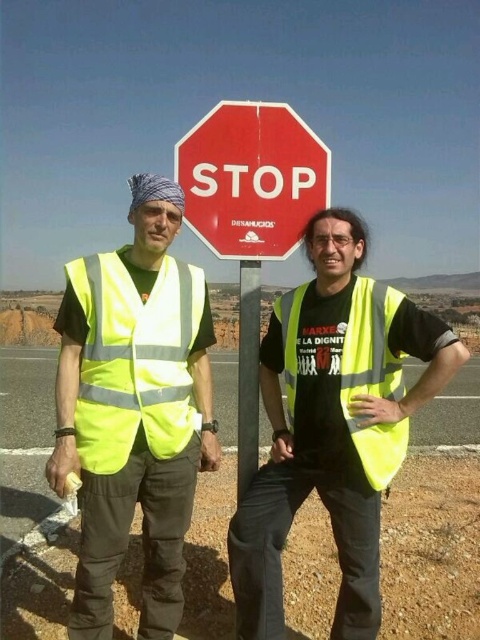
Question: Based on their relative distances, which object is nearer to the metallic gray pole at center?

Choices:
 (A) yellow reflective vest at center
 (B) high visibility yellow safety vest at center
 (C) yellow reflective safety vest at left

Answer: (A)

Question: Among these objects, which one is nearest to the camera?

Choices:
 (A) yellow reflective safety vest at left
 (B) yellow reflective vest at center
 (C) neon yellow reflective vest at left

Answer: (C)

Question: Is yellow reflective safety vest at left below high visibility yellow safety vest at center?

Choices:
 (A) no
 (B) yes

Answer: (A)

Question: Can you confirm if yellow reflective safety vest at left is positioned to the right of red matte stop sign at center?

Choices:
 (A) yes
 (B) no

Answer: (B)

Question: Can you confirm if neon yellow reflective vest at left is thinner than high visibility yellow safety vest at center?

Choices:
 (A) yes
 (B) no

Answer: (B)

Question: Estimate the real-world distances between objects in this image. Which object is farther from the red matte stop sign at center?

Choices:
 (A) neon yellow reflective vest at left
 (B) yellow reflective vest at center
 (C) high visibility yellow safety vest at center
 (D) yellow reflective safety vest at left

Answer: (C)